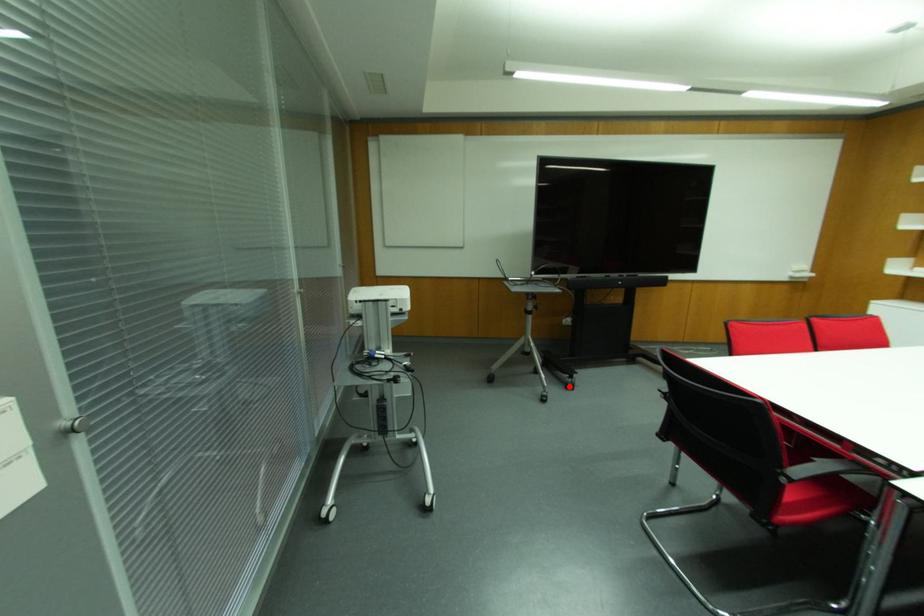
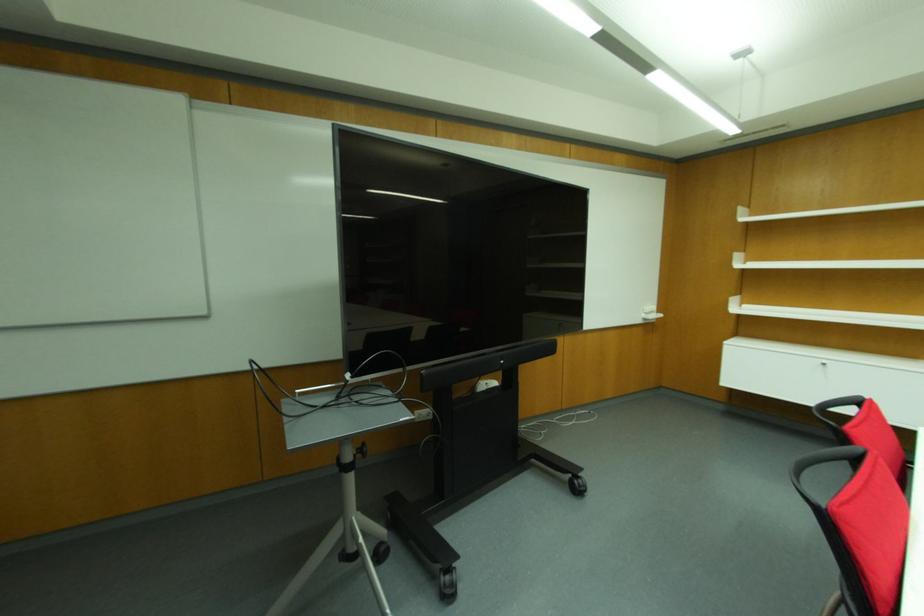
Locate, in the second image, the point that corresponds to the highlighted location in the first image.

(448, 594)